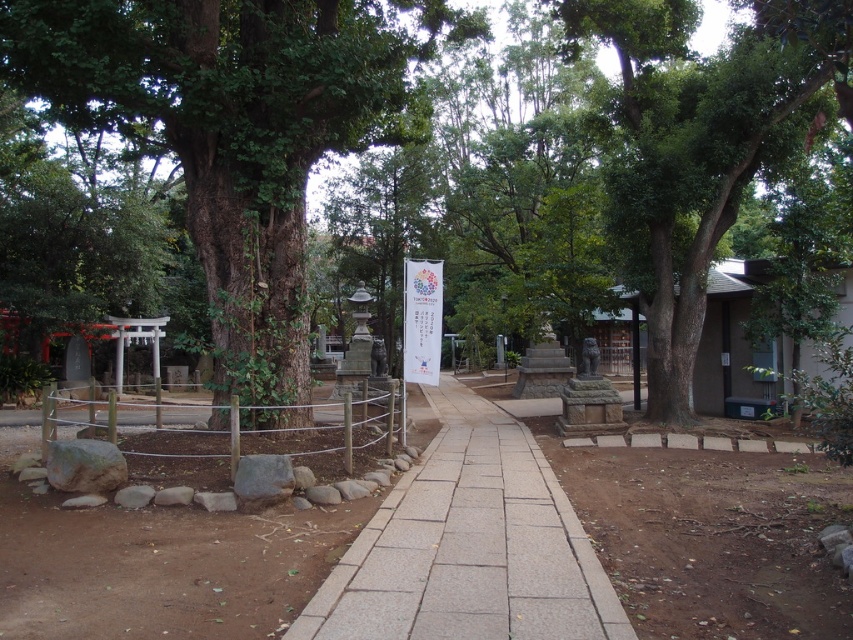
Does green leafy tree at center appear on the left side of gray stone pavement at center?

In fact, green leafy tree at center is to the right of gray stone pavement at center.

Between green leafy tree at center and gray stone pavement at center, which one has more height?

green leafy tree at center

Between point (637, 182) and point (563, 612), which one is positioned in front?

Point (563, 612) is in front.

Identify the location of green leafy tree at center. The width and height of the screenshot is (853, 640). (701, 147).

Between green rough bark tree at center and gray stone pavement at center, which one has more height?

Standing taller between the two is green rough bark tree at center.

Describe the element at coordinates (236, 131) in the screenshot. I see `green rough bark tree at center` at that location.

The image size is (853, 640). In order to click on green rough bark tree at center in this screenshot , I will do `click(236, 131)`.

Consider the image. Which is below, green rough bark tree at center or green leafy tree at center?

green leafy tree at center is below.

Between green rough bark tree at center and green leafy tree at center, which one is positioned higher?

green rough bark tree at center is higher up.

Does point (276, 141) come in front of point (677, 403)?

Yes.

Locate an element on the screen. green rough bark tree at center is located at coordinates (236, 131).